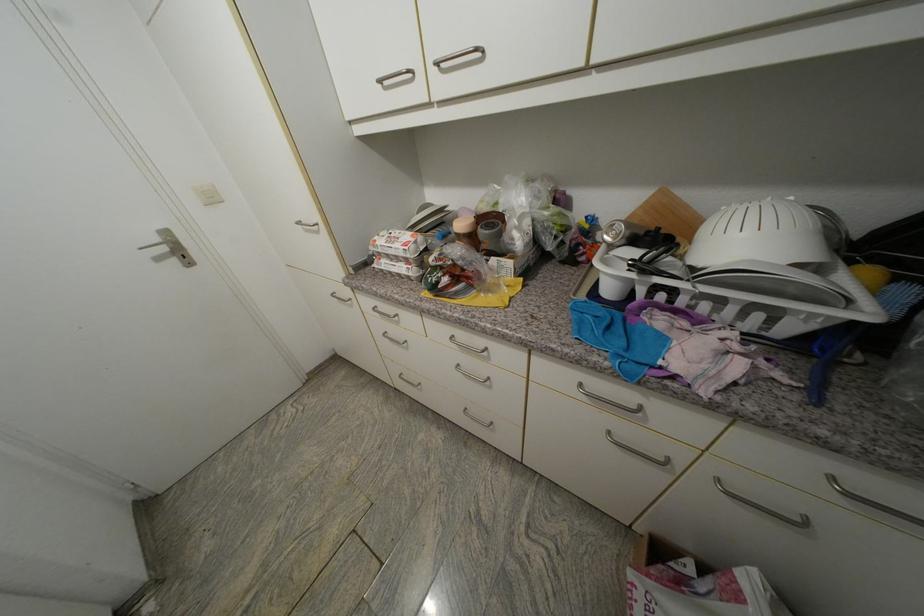
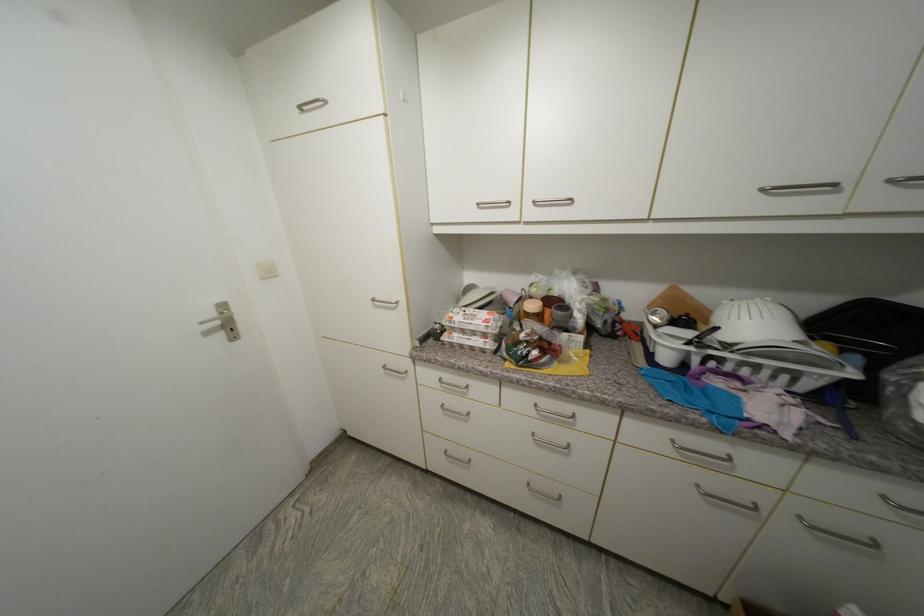
Find the pixel in the second image that matches (x=411, y=262) in the first image.

(490, 337)